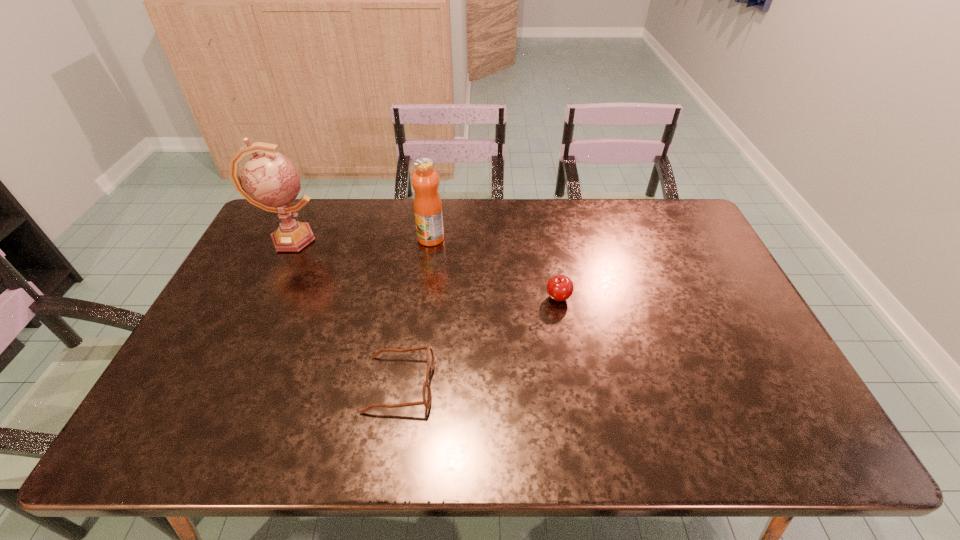
Locate an element on the screen. The image size is (960, 540). vacant area between the rightmost object and the tallest object is located at coordinates (423, 268).

Locate an element on the screen. The height and width of the screenshot is (540, 960). vacant region between the tallest object and the spectacles is located at coordinates (345, 311).

Locate an element on the screen. This screenshot has width=960, height=540. free space that is in between the leftmost object and the spectacles is located at coordinates (345, 311).

The width and height of the screenshot is (960, 540). I want to click on free space between the nearest object and the globe, so click(345, 311).

Locate an element on the screen. This screenshot has width=960, height=540. empty space that is in between the nearest object and the fruit juice is located at coordinates (416, 311).

I want to click on vacant region between the nearest object and the cherry, so click(x=478, y=341).

At what (x,y) coordinates should I click in order to perform the action: click on free space between the rightmost object and the fruit juice. Please return your answer as a coordinate pair (x, y). This screenshot has width=960, height=540. Looking at the image, I should click on (493, 268).

Image resolution: width=960 pixels, height=540 pixels. Identify the location of free point between the spectacles and the third farthest object. (478, 341).

This screenshot has height=540, width=960. Identify the location of free space that is in between the shortest object and the leftmost object. [345, 311].

Identify which object is the closest to the fruit juice. Please provide its 2D coordinates. Your answer should be formatted as a tuple, i.e. [(x, y)], where the tuple contains the x and y coordinates of a point satisfying the conditions above.

[(269, 180)]